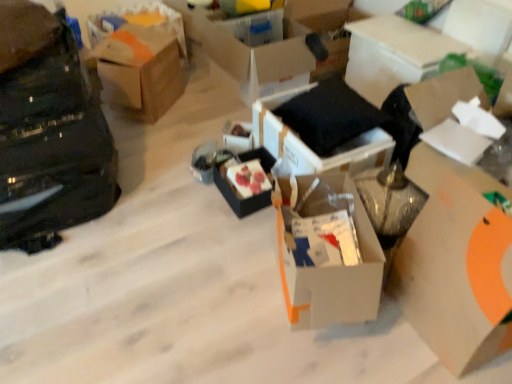
Locate an element on the screen. This screenshot has height=384, width=512. vacant space in between black matte bag at left and black matte box at center, the seventh box from the right is located at coordinates (156, 191).